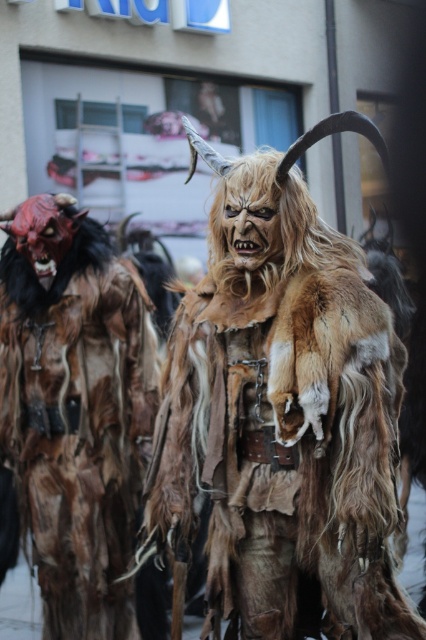
Does furry brown costume at center have a larger size compared to brown furry costume at left?

Indeed, furry brown costume at center has a larger size compared to brown furry costume at left.

Is the position of furry brown costume at center less distant than that of brown furry costume at left?

Yes, furry brown costume at center is in front of brown furry costume at left.

Between point (356, 456) and point (89, 248), which one is positioned in front?

Positioned in front is point (356, 456).

Image resolution: width=426 pixels, height=640 pixels. In order to click on furry brown costume at center in this screenshot , I will do `click(282, 413)`.